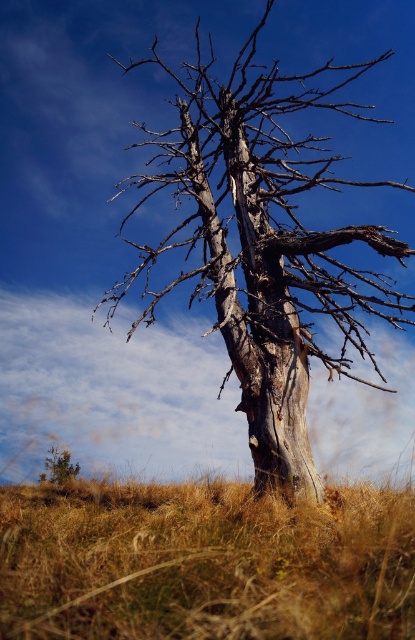
Question: Which object is positioned farthest from the brown textured bush at lower left?

Choices:
 (A) dry grass at lower center
 (B) gray textured tree at center

Answer: (B)

Question: Is dry grass at lower center smaller than brown textured bush at lower left?

Choices:
 (A) no
 (B) yes

Answer: (A)

Question: Which of these objects is positioned closest to the gray textured tree at center?

Choices:
 (A) brown textured bush at lower left
 (B) dry grass at lower center

Answer: (B)

Question: Considering the real-world distances, which object is farthest from the gray textured tree at center?

Choices:
 (A) brown textured bush at lower left
 (B) dry grass at lower center

Answer: (A)

Question: Can you confirm if gray textured tree at center is thinner than brown textured bush at lower left?

Choices:
 (A) yes
 (B) no

Answer: (B)

Question: Does dry grass at lower center come behind gray textured tree at center?

Choices:
 (A) no
 (B) yes

Answer: (A)